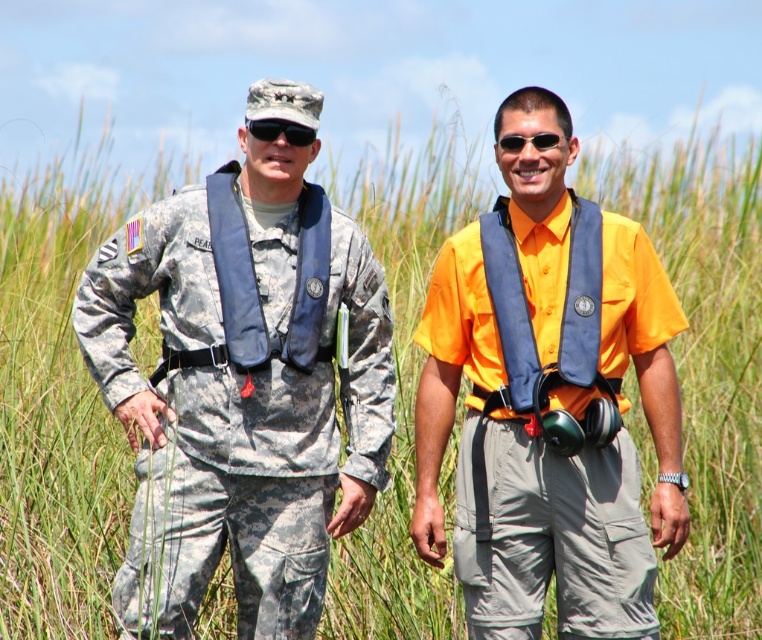
You are a photographer trying to capture a closeup of the yellow matte shirt at center and the blue fabric life vest at center. Since you want to focus on the details of both items, which one should you zoom in on more to ensure it fills the frame better?

The yellow matte shirt at center has a larger width than the blue fabric life vest at center, so you should zoom in more on the yellow matte shirt at center to ensure it fills the frame better.

You are standing in the grassy area and want to locate the yellow matte shirt at center. According to the coordinates provided, in which direction should you move relative to your current position at point 0.5, 0.5?

The yellow matte shirt at center is located at coordinates (548, 401). Since your current position is at (381, 320), you should move northeast to reach it.